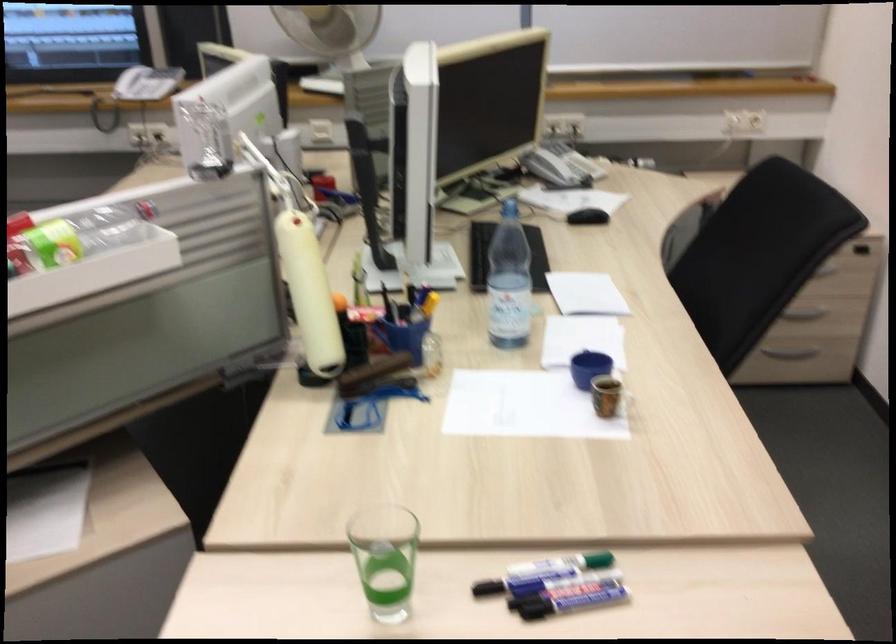
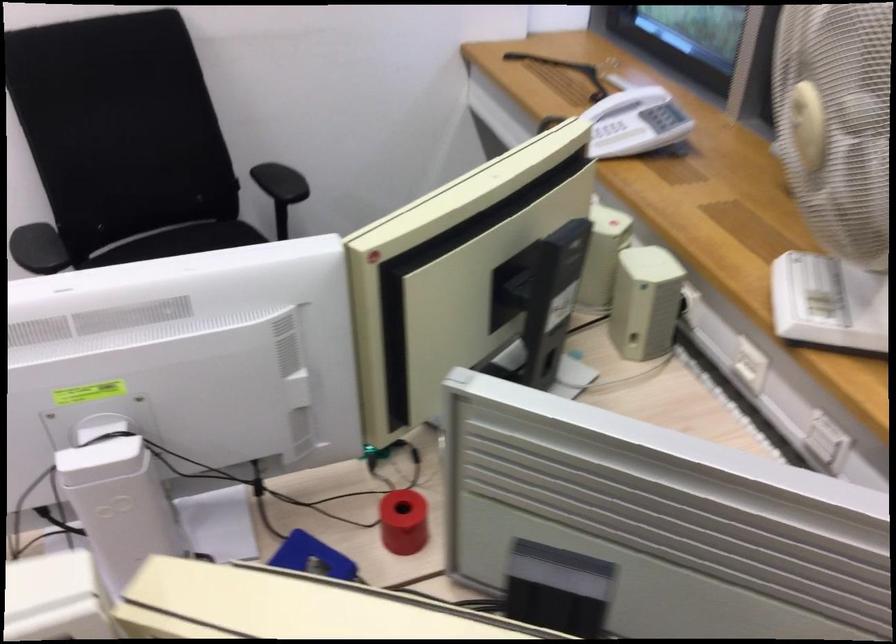
In the second image, find the point that corresponds to point 171,84 in the first image.

(634, 122)